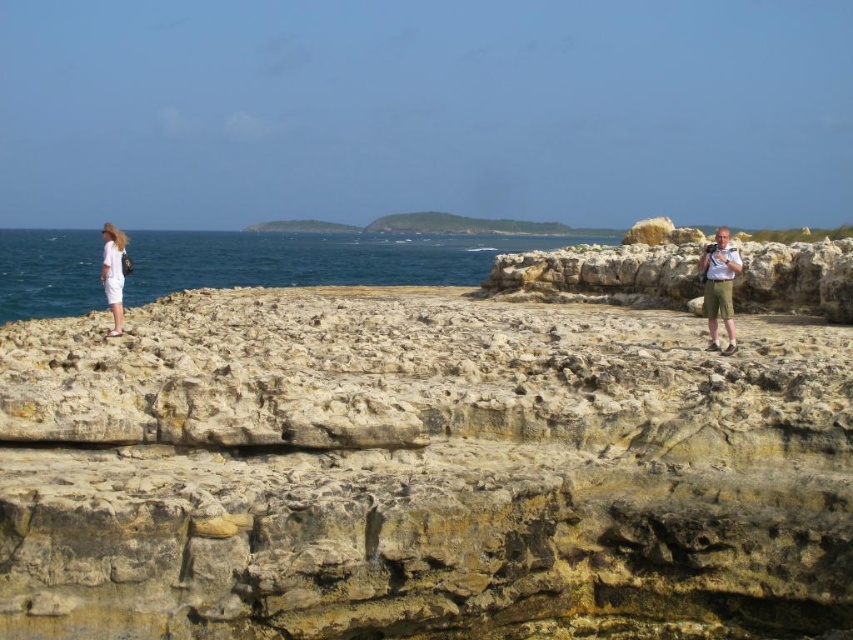
From the picture: You are standing on the rocky terrain and want to take a photo of the blue water at left and the white cotton dress at left. Which object will appear taller in the photo?

The white cotton dress at left will appear taller in the photo because it is taller than the blue water at left.

You are a photographer trying to capture both the khaki shorts at right and the white cotton dress at left in a single frame. Since you want to emphasize the size difference between them, which clothing item should you position closer to the camera?

To emphasize the size difference between the khaki shorts at right and the white cotton dress at left, you should position the khaki shorts at right closer to the camera since it has a lesser width compared to the white cotton dress at left, making it appear larger in the frame.

You are a photographer planning to capture a sunset shot. You notice the blue water at left and the white cotton dress at left in the scene. Which object should you focus on to ensure it appears in the lower part of your photo?

The blue water at left is below the white cotton dress at left, so focusing on the blue water at left will ensure it appears in the lower part of the photo.